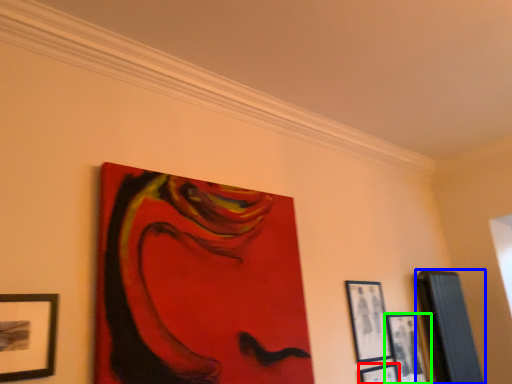
Question: Which object is the closest to the picture frame (highlighted by a red box)? Choose among these: picture frame (highlighted by a blue box) or picture frame (highlighted by a green box).

Choices:
 (A) picture frame
 (B) picture frame

Answer: (B)